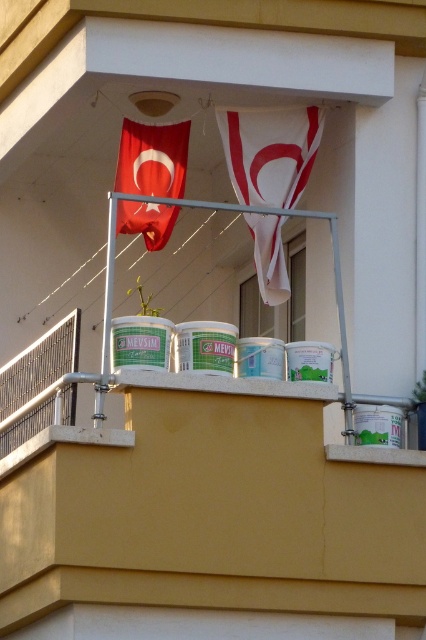
Question: Is white fabric flag at center to the left of matte red flag at upper left from the viewer's perspective?

Choices:
 (A) no
 (B) yes

Answer: (A)

Question: Is white fabric flag at center to the left of matte red flag at upper left from the viewer's perspective?

Choices:
 (A) yes
 (B) no

Answer: (B)

Question: Which point is farther to the camera?

Choices:
 (A) matte red flag at upper left
 (B) white fabric flag at center

Answer: (B)

Question: Is white fabric flag at center thinner than matte red flag at upper left?

Choices:
 (A) yes
 (B) no

Answer: (B)

Question: Which point is farther to the camera?

Choices:
 (A) (282, 262)
 (B) (123, 150)

Answer: (B)